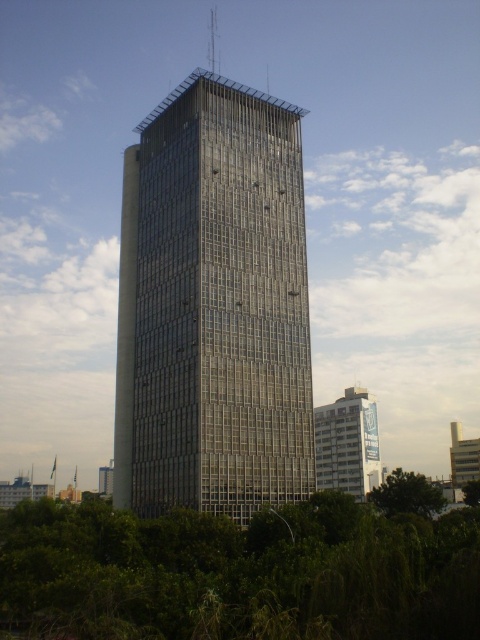
Question: Which object is positioned farthest from the transparent glass tower at center?

Choices:
 (A) green leafy tree at lower right
 (B) green leafy tree at lower center
 (C) white glossy building at lower right

Answer: (A)

Question: Among these objects, which one is nearest to the camera?

Choices:
 (A) transparent glass tower at center
 (B) green leafy tree at lower right
 (C) green leafy tree at lower center

Answer: (C)

Question: Where is transparent glass tower at center located in relation to green leafy tree at lower right in the image?

Choices:
 (A) left
 (B) right

Answer: (A)

Question: Considering the relative positions of green leafy tree at lower center and white glossy building at lower right in the image provided, where is green leafy tree at lower center located with respect to white glossy building at lower right?

Choices:
 (A) below
 (B) above

Answer: (A)

Question: Which point appears farthest from the camera in this image?

Choices:
 (A) (213, 275)
 (B) (428, 497)

Answer: (B)

Question: Is green leafy tree at lower center to the left of white glossy building at lower right from the viewer's perspective?

Choices:
 (A) no
 (B) yes

Answer: (B)